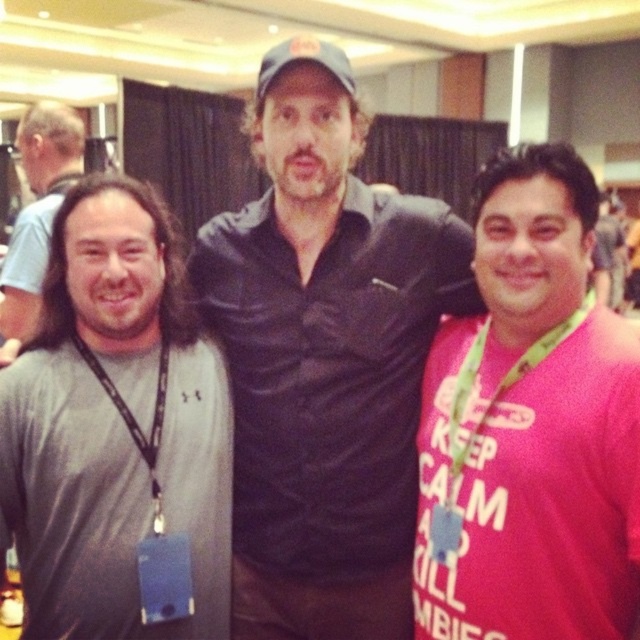
You are a photographer standing 1.5 meters away from the black matte shirt at center. Can you reach out and touch it without moving your feet?

The black matte shirt at center is 1.27 meters away from the viewer, so yes, you can reach out and touch it without moving your feet since it is within arm reach.